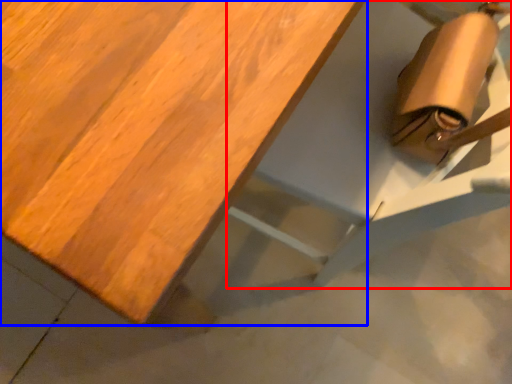
Question: Which object appears farthest to the camera in this image, chair (highlighted by a red box) or table (highlighted by a blue box)?

Choices:
 (A) chair
 (B) table

Answer: (A)